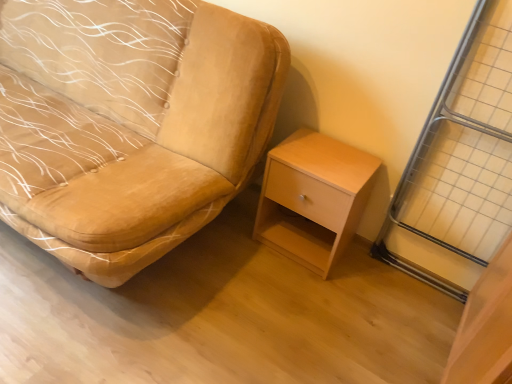
You are a GUI agent. You are given a task and a screenshot of the screen. Output one action in this format:
    pyautogui.click(x=<x>, y=<y>)
    Task: Click on the vacant space to the right of light wood/finely finished nightstand at lower right
    
    Given the screenshot: What is the action you would take?
    tap(371, 283)